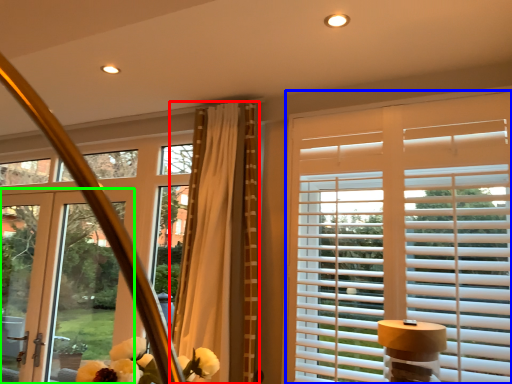
Question: Estimate the real-world distances between objects in this image. Which object is closer to curtain (highlighted by a red box), window blind (highlighted by a blue box) or door (highlighted by a green box)?

Choices:
 (A) window blind
 (B) door

Answer: (A)